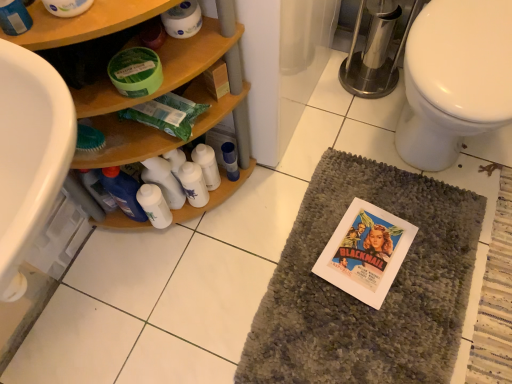
Image resolution: width=512 pixels, height=384 pixels. I want to click on vacant area that lies between white glossy bottles at center, the first toiletry positioned from the right, and gray textured bath mat at center, so 252,239.